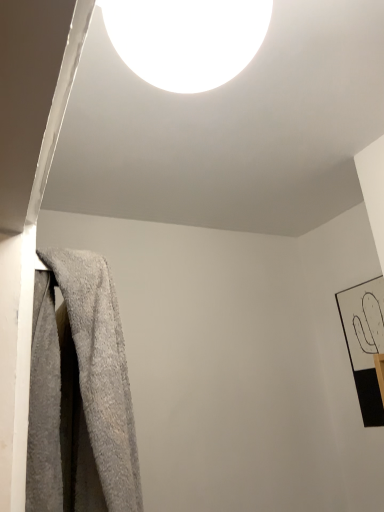
Question: From the image's perspective, is black matte picture frame at right on top of gray fluffy towel at left?

Choices:
 (A) yes
 (B) no

Answer: (B)

Question: Does black matte picture frame at right have a lesser width compared to gray fluffy towel at left?

Choices:
 (A) no
 (B) yes

Answer: (B)

Question: From a real-world perspective, is black matte picture frame at right under gray fluffy towel at left?

Choices:
 (A) no
 (B) yes

Answer: (A)

Question: Does black matte picture frame at right have a larger size compared to gray fluffy towel at left?

Choices:
 (A) yes
 (B) no

Answer: (B)

Question: Could you tell me if black matte picture frame at right is facing gray fluffy towel at left?

Choices:
 (A) no
 (B) yes

Answer: (B)

Question: Is gray fluffy towel at left completely or partially inside black matte picture frame at right?

Choices:
 (A) yes
 (B) no

Answer: (B)

Question: From a real-world perspective, is gray fluffy towel at left positioned over white glossy light fixture at upper center based on gravity?

Choices:
 (A) yes
 (B) no

Answer: (B)

Question: Does gray fluffy towel at left have a greater height compared to white glossy light fixture at upper center?

Choices:
 (A) no
 (B) yes

Answer: (B)

Question: Considering the relative sizes of gray fluffy towel at left and white glossy light fixture at upper center in the image provided, is gray fluffy towel at left bigger than white glossy light fixture at upper center?

Choices:
 (A) yes
 (B) no

Answer: (A)

Question: Can you confirm if gray fluffy towel at left is shorter than white glossy light fixture at upper center?

Choices:
 (A) yes
 (B) no

Answer: (B)

Question: Does gray fluffy towel at left lie behind white glossy light fixture at upper center?

Choices:
 (A) yes
 (B) no

Answer: (A)

Question: Is gray fluffy towel at left far from white glossy light fixture at upper center?

Choices:
 (A) yes
 (B) no

Answer: (B)

Question: From the image's perspective, does white glossy light fixture at upper center appear lower than gray fluffy towel at left?

Choices:
 (A) no
 (B) yes

Answer: (A)